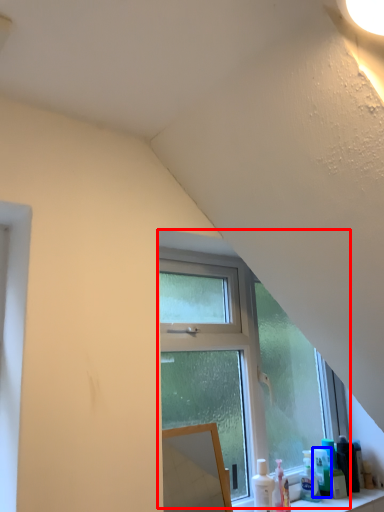
Question: Which object appears closest to the camera in this image, window (highlighted by a red box) or toiletry (highlighted by a blue box)?

Choices:
 (A) window
 (B) toiletry

Answer: (A)